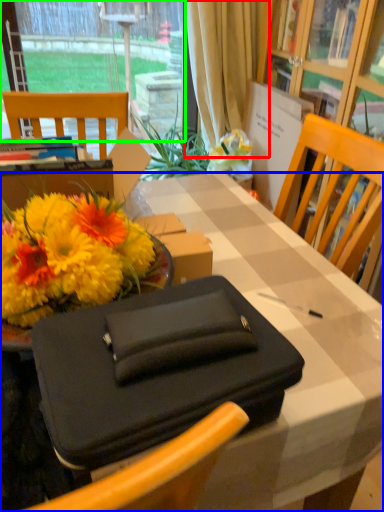
Question: Which is nearer to the curtain (highlighted by a red box)? desk (highlighted by a blue box) or window (highlighted by a green box).

Choices:
 (A) desk
 (B) window

Answer: (B)